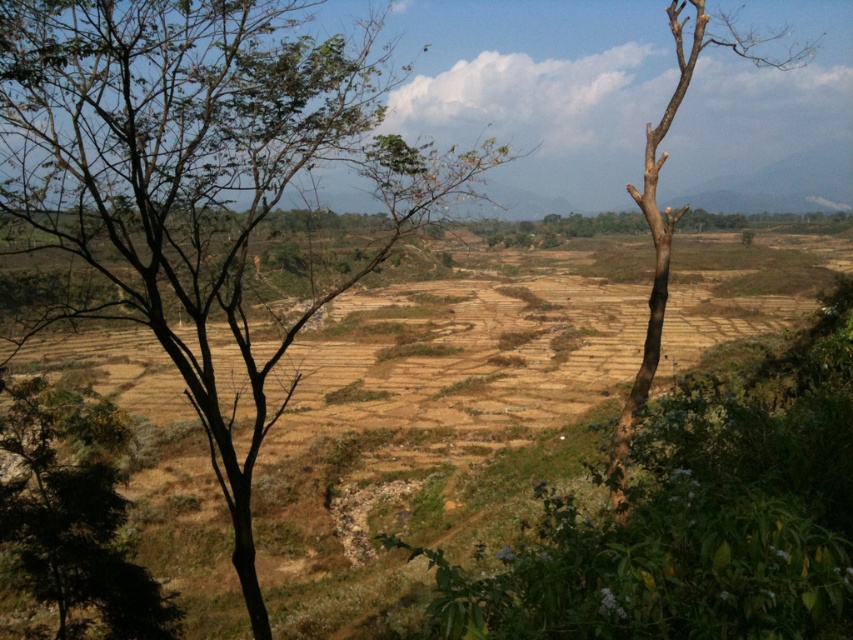
You are a bird seeking shelter. You notice two trees in the scene. Which tree, the brown leafy tree at left or the bare wood tree at right, is taller and thus might provide better shelter?

The brown leafy tree at left has a lesser height compared to the bare wood tree at right, so the bare wood tree at right is taller and might provide better shelter.